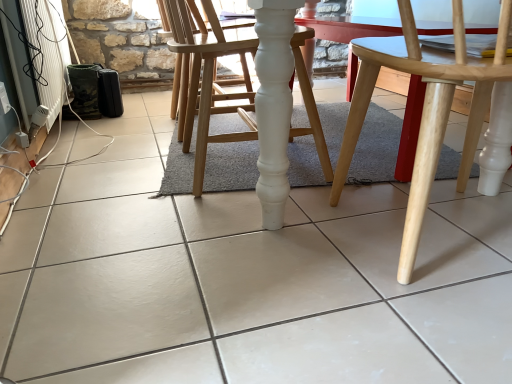
Question: Does natural wood chair at center, the second chair from the left, have a greater height compared to white wood chair at center, which ranks as the 1th chair in left-to-right order?

Choices:
 (A) no
 (B) yes

Answer: (A)

Question: From the image's perspective, is natural wood chair at center, the second chair from the left, located beneath white wood chair at center, which ranks as the 1th chair in left-to-right order?

Choices:
 (A) no
 (B) yes

Answer: (B)

Question: Does natural wood chair at center, the second chair from the left, appear on the left side of white wood chair at center, which ranks as the 1th chair in left-to-right order?

Choices:
 (A) no
 (B) yes

Answer: (A)

Question: Is natural wood chair at center, the second chair from the left, positioned behind white wood chair at center, which ranks as the 1th chair in left-to-right order?

Choices:
 (A) yes
 (B) no

Answer: (B)

Question: Does natural wood chair at center, the second chair from the left, have a lesser height compared to white wood chair at center, which ranks as the 1th chair in left-to-right order?

Choices:
 (A) yes
 (B) no

Answer: (A)

Question: Is natural wood chair at center, which is the 1th chair from right to left, smaller than white wood chair at center, which ranks as the 1th chair in left-to-right order?

Choices:
 (A) yes
 (B) no

Answer: (B)

Question: Can you confirm if natural wood chair at center, which is the 1th chair from right to left, is positioned to the left of white plastic radiator at lower left?

Choices:
 (A) no
 (B) yes

Answer: (A)

Question: Is natural wood chair at center, which is the 1th chair from right to left, shorter than white plastic radiator at lower left?

Choices:
 (A) yes
 (B) no

Answer: (B)

Question: Is natural wood chair at center, which is the 1th chair from right to left, oriented towards white plastic radiator at lower left?

Choices:
 (A) yes
 (B) no

Answer: (B)

Question: Can you confirm if natural wood chair at center, which is the 1th chair from right to left, is wider than white plastic radiator at lower left?

Choices:
 (A) yes
 (B) no

Answer: (A)

Question: Considering the relative positions of natural wood chair at center, the second chair from the left, and white plastic radiator at lower left in the image provided, is natural wood chair at center, the second chair from the left, in front of white plastic radiator at lower left?

Choices:
 (A) no
 (B) yes

Answer: (B)

Question: Is natural wood chair at center, the second chair from the left, further to camera compared to white plastic radiator at lower left?

Choices:
 (A) no
 (B) yes

Answer: (A)

Question: Does white wood chair at center, which ranks as the 1th chair in left-to-right order, contain white plastic radiator at lower left?

Choices:
 (A) yes
 (B) no

Answer: (B)